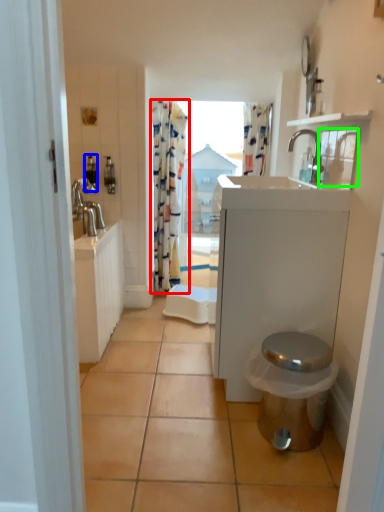
Question: Which object is positioned closest to curtain (highlighted by a red box)? Select from toiletry (highlighted by a blue box) and medicine cabinet (highlighted by a green box).

Choices:
 (A) toiletry
 (B) medicine cabinet

Answer: (A)